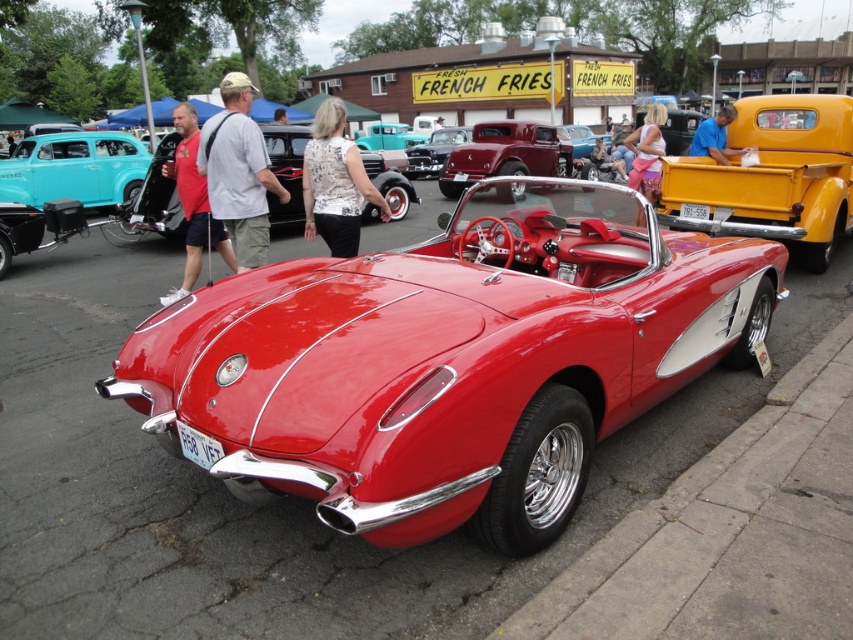
Does shiny red convertible at center have a greater width compared to white floral blouse at center?

Indeed, shiny red convertible at center has a greater width compared to white floral blouse at center.

Is shiny red convertible at center smaller than white floral blouse at center?

Actually, shiny red convertible at center might be larger than white floral blouse at center.

Where is `shiny red convertible at center`? shiny red convertible at center is located at coordinates (448, 364).

Locate an element on the screen. shiny red convertible at center is located at coordinates (x=448, y=364).

Between teal matte sedan at left and blue fabric shirt at upper center, which one appears on the left side from the viewer's perspective?

teal matte sedan at left

Identify the location of teal matte sedan at left. (74, 168).

Locate an element on the screen. The width and height of the screenshot is (853, 640). teal matte sedan at left is located at coordinates (74, 168).

Does point (257, 140) come closer to viewer compared to point (82, 163)?

Yes, point (257, 140) is closer to viewer.

Who is more forward, (282, 188) or (30, 140)?

Point (282, 188)

Is point (235, 237) more distant than point (71, 173)?

No, (235, 237) is in front of (71, 173).

Image resolution: width=853 pixels, height=640 pixels. I want to click on white cotton shirt at center, so click(238, 172).